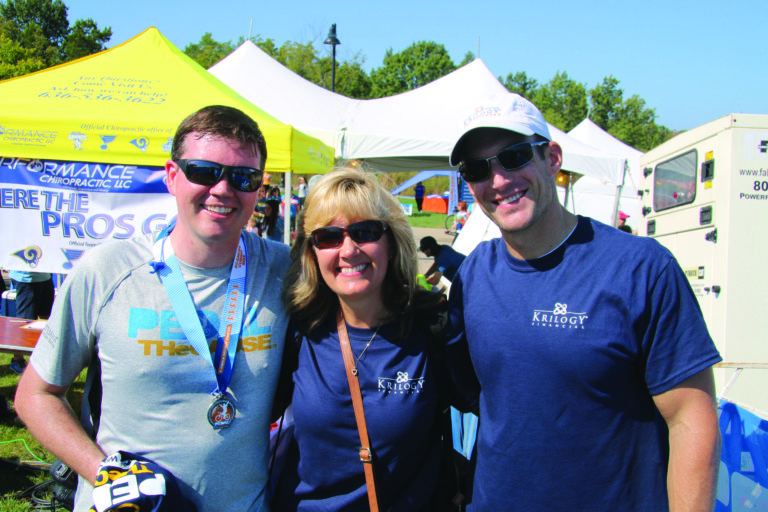
Locate an element on the screen. This screenshot has height=512, width=768. pendant is located at coordinates (353, 373).